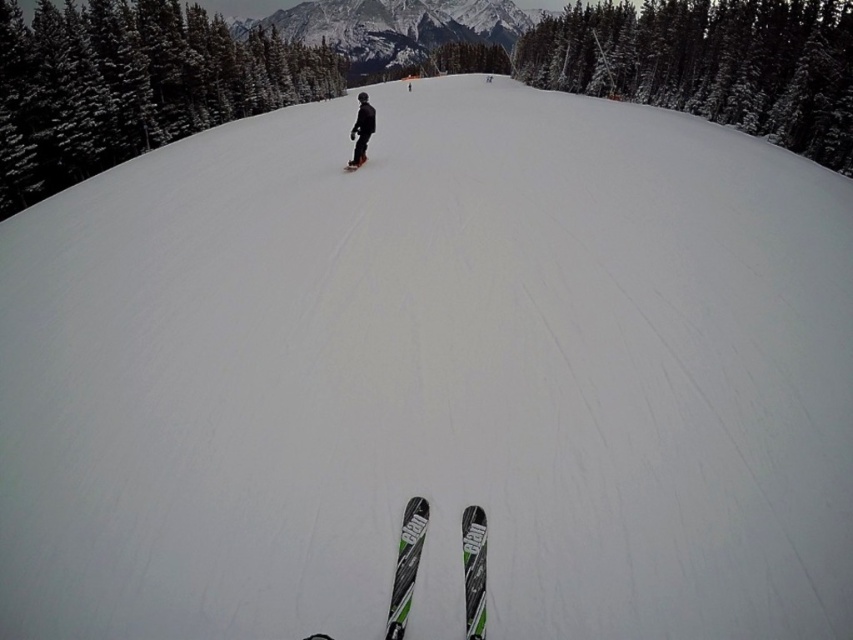
Can you confirm if green textured snowboard at upper center is bigger than black matte snowboard at center?

Correct, green textured snowboard at upper center is larger in size than black matte snowboard at center.

Locate an element on the screen. green textured snowboard at upper center is located at coordinates (131, 84).

Who is higher up, green textured snowboard at upper center or snowy evergreen tree at upper right?

snowy evergreen tree at upper right is above.

Which is more to the left, green textured snowboard at upper center or snowy evergreen tree at upper right?

Positioned to the left is green textured snowboard at upper center.

Is point (320, 64) closer to camera compared to point (619, 6)?

That is False.

You are a GUI agent. You are given a task and a screenshot of the screen. Output one action in this format:
    pyautogui.click(x=<x>, y=<y>)
    Task: Click on the green textured snowboard at upper center
    The image size is (853, 640).
    Given the screenshot: What is the action you would take?
    pyautogui.click(x=131, y=84)

Can you confirm if green matte skis at center is shorter than black matte snowboard at center?

Yes.

Is point (410, 548) farther from camera compared to point (344, 170)?

That is False.

I want to click on green matte skis at center, so click(x=405, y=564).